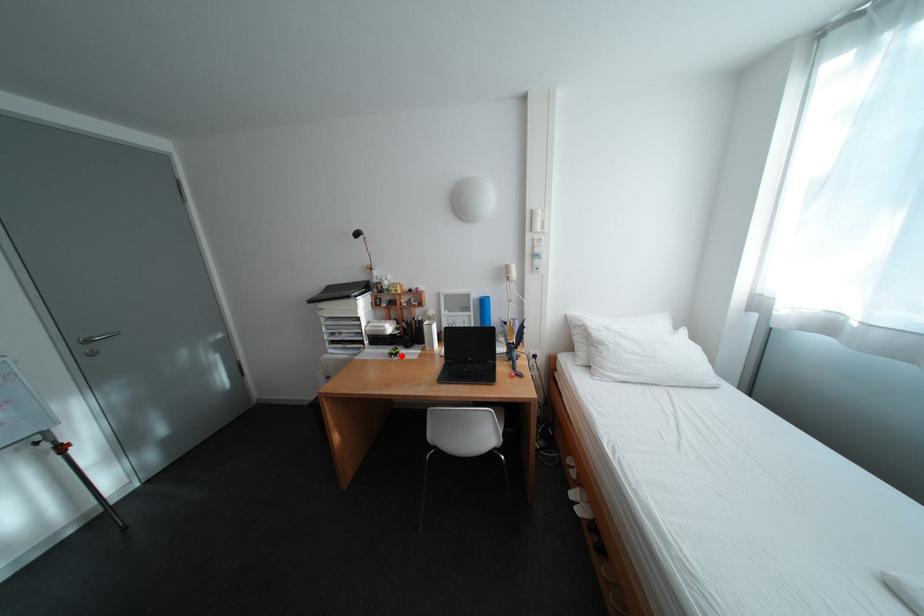
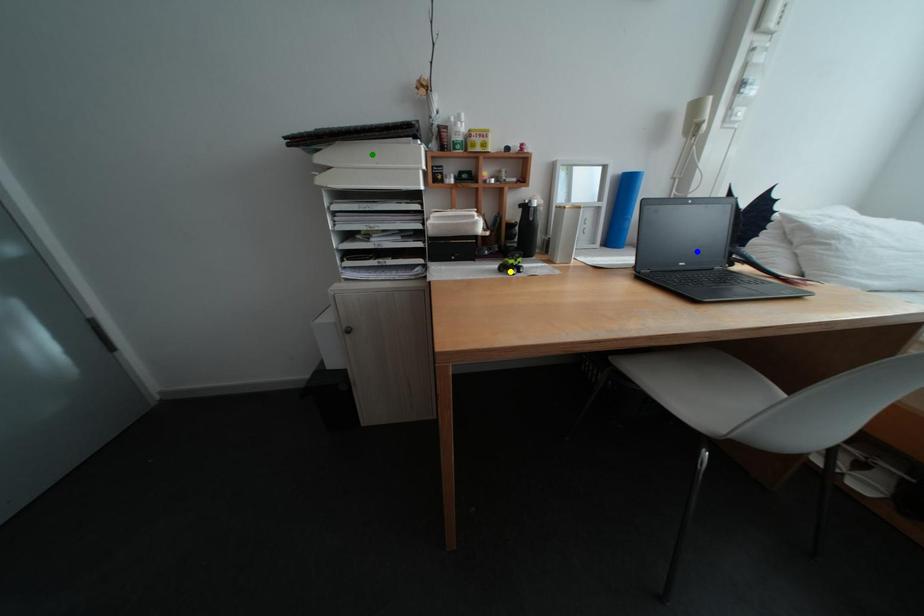
Question: I am providing you with two images of the same scene from different viewpoints. A red point is marked on the first image. You are given multiple points on the second image. Which point in image 2 is actually the same real-world point as the red point in image 1?

Choices:
 (A) blue point
 (B) green point
 (C) yellow point

Answer: (C)